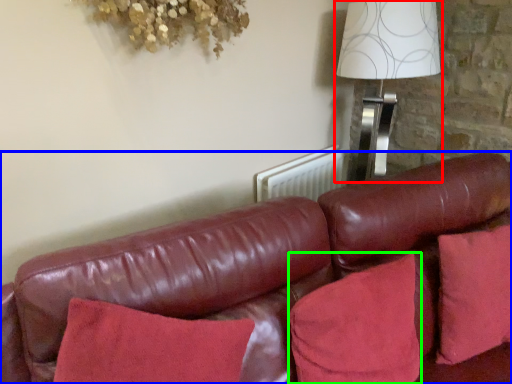
Question: Based on their relative distances, which object is farther from table lamp (highlighted by a red box)? Choose from studio couch (highlighted by a blue box) and pillow (highlighted by a green box).

Choices:
 (A) studio couch
 (B) pillow

Answer: (B)